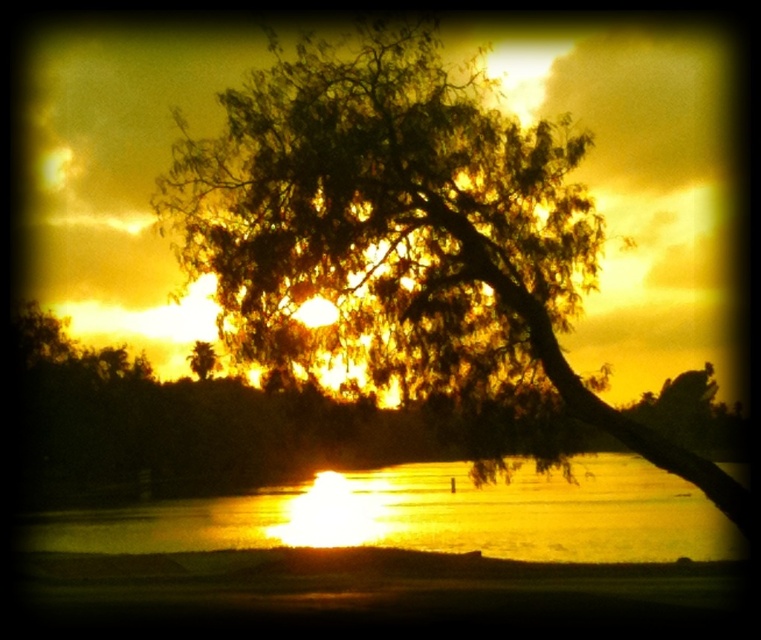
Is green leafy tree at center positioned before glistening water at center?

That is False.

Is green leafy tree at center bigger than glistening water at center?

Incorrect, green leafy tree at center is not larger than glistening water at center.

Describe the element at coordinates (406, 221) in the screenshot. I see `green leafy tree at center` at that location.

Where is `green leafy tree at center`? This screenshot has width=761, height=640. green leafy tree at center is located at coordinates (406, 221).